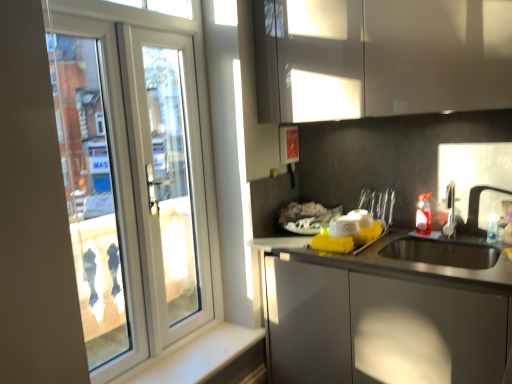
Question: In the image, is white plastic door at left positioned in front of or behind glossy white cabinet at upper center?

Choices:
 (A) front
 (B) behind

Answer: (B)

Question: In terms of size, does white plastic door at left appear bigger or smaller than glossy white cabinet at upper center?

Choices:
 (A) small
 (B) big

Answer: (A)

Question: Which object is positioned closest to the glossy white cabinet at upper center?

Choices:
 (A) white plastic screen door at left
 (B) white plastic door at left
 (C) satin nickel faucet at sink right
 (D) white smooth window sill at lower left

Answer: (A)

Question: Which of these objects is positioned closest to the white plastic door at left?

Choices:
 (A) white plastic screen door at left
 (B) white smooth window sill at lower left
 (C) satin nickel faucet at sink right
 (D) glossy white cabinet at upper center

Answer: (A)